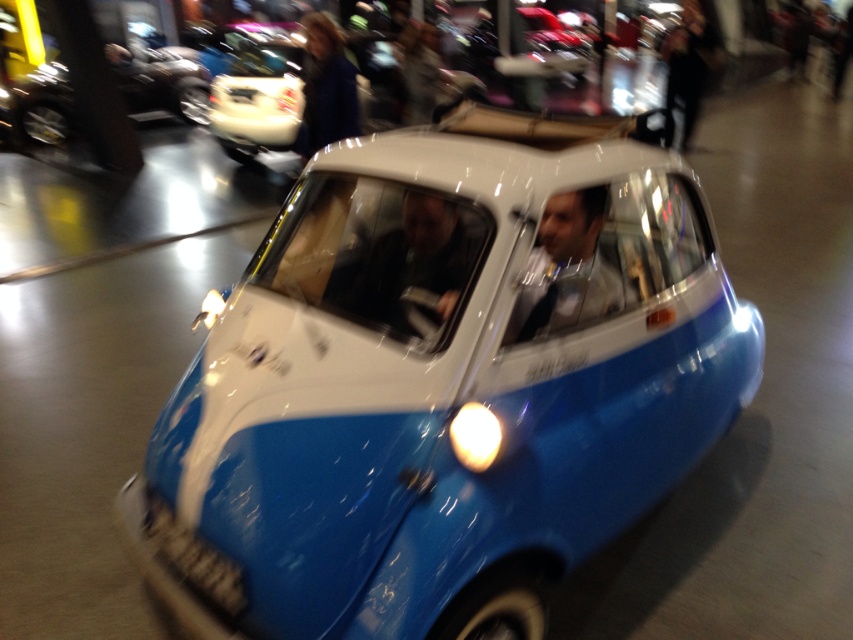
This screenshot has width=853, height=640. Find the location of `blue matte toy car at center`. blue matte toy car at center is located at coordinates (440, 390).

Is point (439, 445) farther from viewer compared to point (310, 38)?

That is False.

Does point (473, 276) come behind point (311, 115)?

No, it is not.

Where is `blue matte toy car at center`? The width and height of the screenshot is (853, 640). blue matte toy car at center is located at coordinates pyautogui.click(x=440, y=390).

Is matte blue car at center closer to camera compared to blue fabric coat at upper center?

Yes, matte blue car at center is closer to the viewer.

Does matte blue car at center appear on the left side of blue fabric coat at upper center?

Incorrect, matte blue car at center is not on the left side of blue fabric coat at upper center.

Does point (593, 224) lie in front of point (320, 77)?

Yes.

This screenshot has width=853, height=640. In order to click on matte blue car at center in this screenshot , I will do coord(567,266).

Is blue matte toy car at center wider than matte black suit at center?

Yes, blue matte toy car at center is wider than matte black suit at center.

Is blue matte toy car at center thinner than matte black suit at center?

No, blue matte toy car at center is not thinner than matte black suit at center.

Describe the element at coordinates (440, 390) in the screenshot. I see `blue matte toy car at center` at that location.

In order to click on blue matte toy car at center in this screenshot , I will do (440, 390).